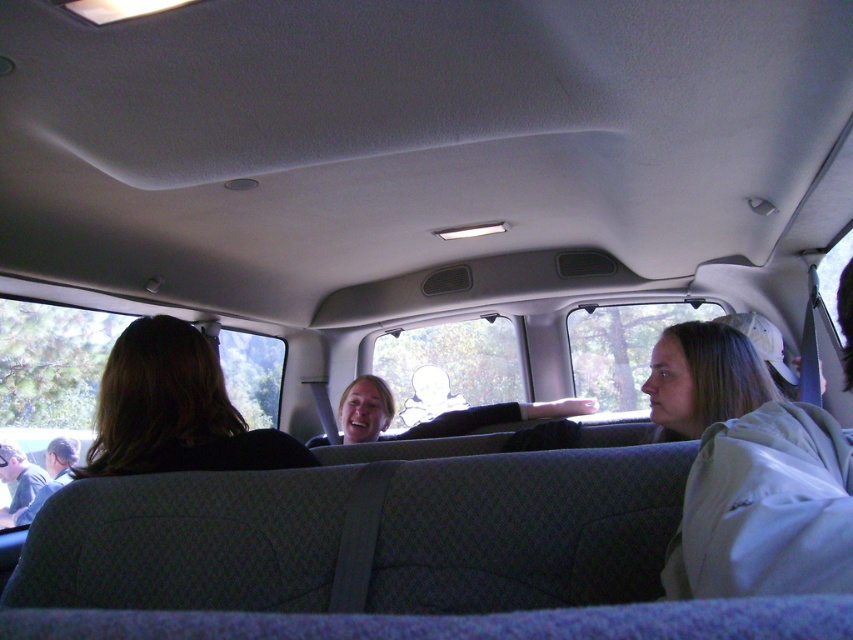
Does point (543, 412) lie behind point (55, 454)?

No, (543, 412) is in front of (55, 454).

Does matte black shirt at center come behind dark gray shirt at lower left?

No, matte black shirt at center is in front of dark gray shirt at lower left.

At what (x,y) coordinates should I click in order to perform the action: click on matte black shirt at center. Please return your answer as a coordinate pair (x, y). This screenshot has width=853, height=640. Looking at the image, I should click on (438, 413).

Is dark brown hair at left positioned before matte black shirt at center?

Yes, dark brown hair at left is in front of matte black shirt at center.

Is dark brown hair at left thinner than matte black shirt at center?

Correct, dark brown hair at left's width is less than matte black shirt at center's.

Find the location of `dark brown hair at left`. dark brown hair at left is located at coordinates (175, 410).

Find the location of a particular element. The image size is (853, 640). dark brown hair at left is located at coordinates (175, 410).

Which is above, dark brown hair at left or dark gray shirt at lower left?

dark brown hair at left is higher up.

Find the location of a particular element. The width and height of the screenshot is (853, 640). dark brown hair at left is located at coordinates (175, 410).